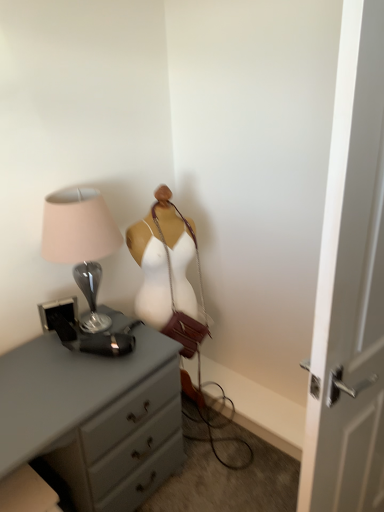
Question: Is metallic glass lamp at left not within gray matte chest of drawers at left?

Choices:
 (A) yes
 (B) no

Answer: (A)

Question: Is metallic glass lamp at left not close to gray matte chest of drawers at left?

Choices:
 (A) no
 (B) yes

Answer: (A)

Question: Considering the relative sizes of metallic glass lamp at left and gray matte chest of drawers at left in the image provided, is metallic glass lamp at left thinner than gray matte chest of drawers at left?

Choices:
 (A) no
 (B) yes

Answer: (B)

Question: Is gray matte chest of drawers at left located within metallic glass lamp at left?

Choices:
 (A) yes
 (B) no

Answer: (B)

Question: Considering the relative positions of metallic glass lamp at left and gray matte chest of drawers at left in the image provided, is metallic glass lamp at left to the left of gray matte chest of drawers at left from the viewer's perspective?

Choices:
 (A) yes
 (B) no

Answer: (B)

Question: Is metallic glass lamp at left inside or outside of white wooden door at right?

Choices:
 (A) outside
 (B) inside

Answer: (A)

Question: In the image, is metallic glass lamp at left on the left side or the right side of white wooden door at right?

Choices:
 (A) right
 (B) left

Answer: (B)

Question: Is metallic glass lamp at left wider or thinner than white wooden door at right?

Choices:
 (A) wide
 (B) thin

Answer: (A)

Question: Considering the positions of point (x=86, y=257) and point (x=354, y=121), is point (x=86, y=257) closer or farther from the camera than point (x=354, y=121)?

Choices:
 (A) farther
 (B) closer

Answer: (A)

Question: Does point (336, 457) appear closer or farther from the camera than point (59, 418)?

Choices:
 (A) farther
 (B) closer

Answer: (B)

Question: Is white wooden door at right inside or outside of gray matte chest of drawers at left?

Choices:
 (A) inside
 (B) outside

Answer: (B)

Question: Based on their positions, is white wooden door at right located to the left or right of gray matte chest of drawers at left?

Choices:
 (A) right
 (B) left

Answer: (A)

Question: In terms of height, does white wooden door at right look taller or shorter compared to gray matte chest of drawers at left?

Choices:
 (A) short
 (B) tall

Answer: (B)

Question: Would you say gray matte chest of drawers at left is inside or outside white wooden door at right?

Choices:
 (A) outside
 (B) inside

Answer: (A)

Question: Does point (150, 452) appear closer or farther from the camera than point (349, 486)?

Choices:
 (A) closer
 (B) farther

Answer: (B)